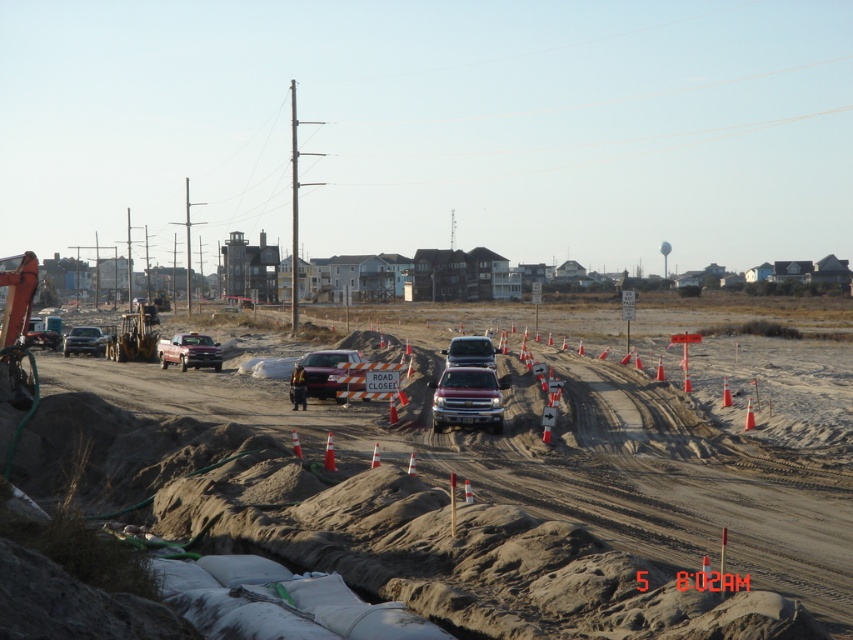
Between point (96, 337) and point (292, 406), which one is positioned behind?

The point (96, 337) is more distant.

Between point (62, 342) and point (294, 397), which one is positioned in front?

Point (294, 397) is more forward.

Image resolution: width=853 pixels, height=640 pixels. I want to click on matte black truck at left, so click(85, 340).

Between matte orange traffic cones at center and satin silver suv at center, which one has less height?

satin silver suv at center

Between point (689, 528) and point (461, 362), which one is positioned in front?

Point (689, 528)

Is point (241, 490) behind point (468, 349)?

That is False.

This screenshot has width=853, height=640. Identify the location of matte orange traffic cones at center. pos(439,502).

What do you see at coordinates (325, 371) in the screenshot? This screenshot has width=853, height=640. I see `matte black truck at center` at bounding box center [325, 371].

Which is in front, point (335, 349) or point (190, 355)?

Point (335, 349)

Locate an element on the screen. matte black truck at center is located at coordinates (325, 371).